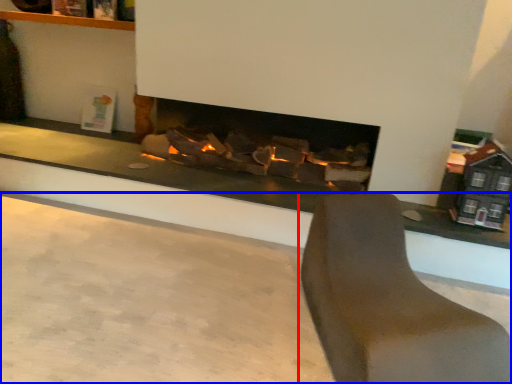
Question: Which object appears farthest to the camera in this image, furniture (highlighted by a red box) or concrete (highlighted by a blue box)?

Choices:
 (A) furniture
 (B) concrete

Answer: (A)